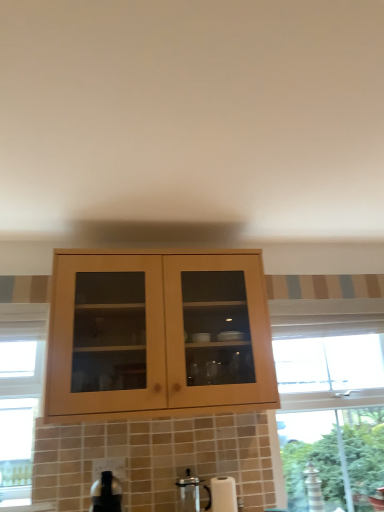
Question: Would you say satin silver kettle at lower center is outside satin silver coffee machine at lower center?

Choices:
 (A) no
 (B) yes

Answer: (B)

Question: Does satin silver kettle at lower center have a smaller size compared to satin silver coffee machine at lower center?

Choices:
 (A) no
 (B) yes

Answer: (A)

Question: Is satin silver kettle at lower center behind satin silver coffee machine at lower center?

Choices:
 (A) no
 (B) yes

Answer: (A)

Question: Can you confirm if satin silver kettle at lower center is shorter than satin silver coffee machine at lower center?

Choices:
 (A) yes
 (B) no

Answer: (A)

Question: Is satin silver kettle at lower center closer to camera compared to satin silver coffee machine at lower center?

Choices:
 (A) no
 (B) yes

Answer: (B)

Question: Is satin silver kettle at lower center facing away from satin silver coffee machine at lower center?

Choices:
 (A) no
 (B) yes

Answer: (A)

Question: From a real-world perspective, is satin silver coffee machine at lower center located higher than satin silver kettle at lower center?

Choices:
 (A) yes
 (B) no

Answer: (B)

Question: Is satin silver coffee machine at lower center in front of satin silver kettle at lower center?

Choices:
 (A) yes
 (B) no

Answer: (B)

Question: Considering the relative sizes of satin silver coffee machine at lower center and satin silver kettle at lower center in the image provided, is satin silver coffee machine at lower center shorter than satin silver kettle at lower center?

Choices:
 (A) yes
 (B) no

Answer: (B)

Question: From the image's perspective, does satin silver coffee machine at lower center appear higher than satin silver kettle at lower center?

Choices:
 (A) no
 (B) yes

Answer: (A)

Question: Is satin silver coffee machine at lower center located outside satin silver kettle at lower center?

Choices:
 (A) no
 (B) yes

Answer: (B)

Question: Is satin silver coffee machine at lower center wider than satin silver kettle at lower center?

Choices:
 (A) no
 (B) yes

Answer: (A)

Question: Is point (92, 509) closer or farther from the camera than point (203, 480)?

Choices:
 (A) farther
 (B) closer

Answer: (B)